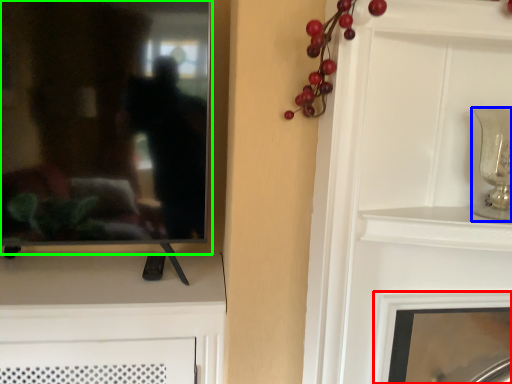
Question: Considering the real-world distances, which object is farthest from fireplace (highlighted by a red box)? candle holder (highlighted by a blue box) or mirror (highlighted by a green box)?

Choices:
 (A) candle holder
 (B) mirror

Answer: (B)